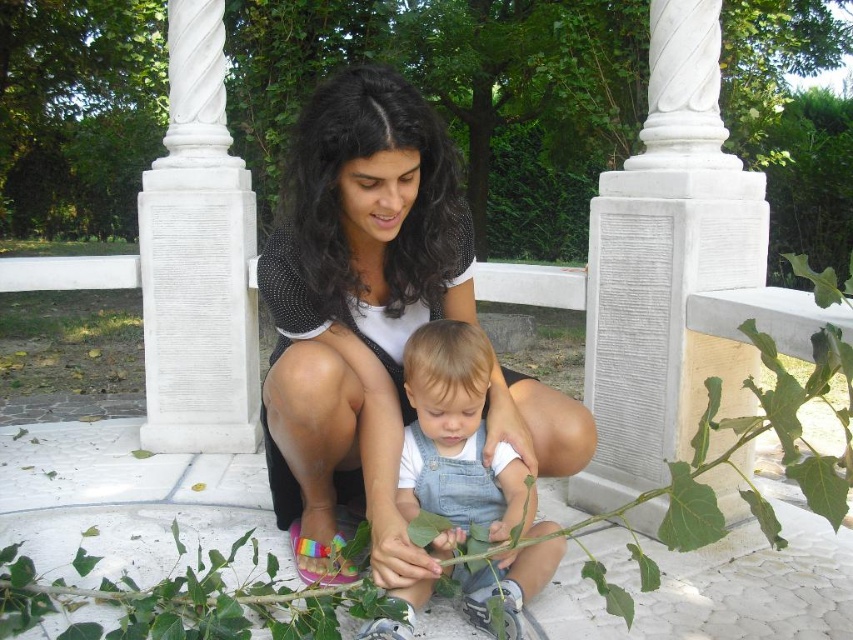
Who is shorter, black mesh top at center or denim overalls at center?

Standing shorter between the two is denim overalls at center.

Who is positioned more to the left, black mesh top at center or denim overalls at center?

From the viewer's perspective, black mesh top at center appears more on the left side.

Which is behind, point (346, 387) or point (457, 387)?

Positioned behind is point (346, 387).

This screenshot has height=640, width=853. I want to click on black mesh top at center, so click(357, 308).